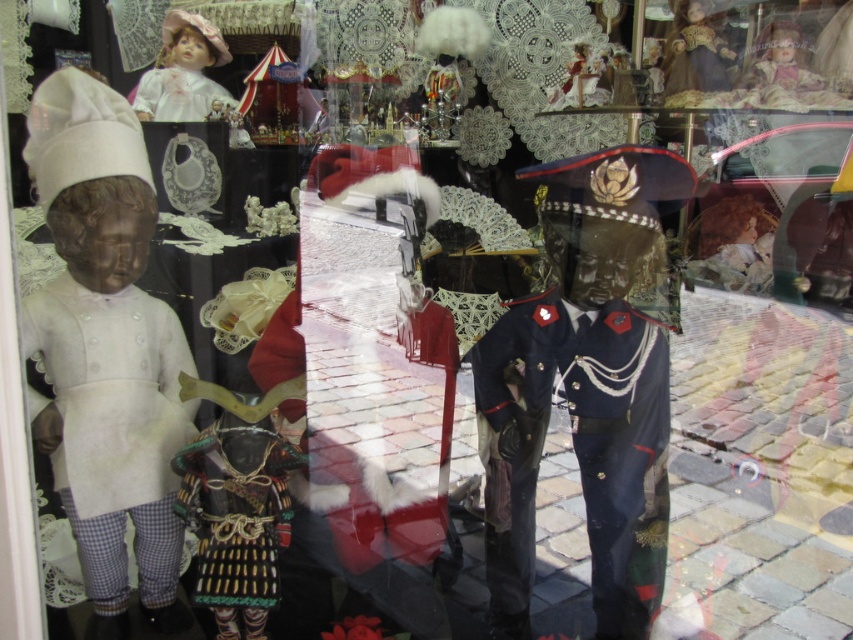
Does white matte fabric at left appear on the right side of porcelain doll at upper left?

Indeed, white matte fabric at left is positioned on the right side of porcelain doll at upper left.

Is white matte fabric at left to the left of porcelain doll at upper left from the viewer's perspective?

No, white matte fabric at left is not to the left of porcelain doll at upper left.

Find the location of a particular element. white matte fabric at left is located at coordinates (112, 413).

Does navy blue fabric uniform at center have a lesser width compared to porcelain doll at upper left?

In fact, navy blue fabric uniform at center might be wider than porcelain doll at upper left.

From the picture: Is navy blue fabric uniform at center to the right of porcelain doll at upper left from the viewer's perspective?

Correct, you'll find navy blue fabric uniform at center to the right of porcelain doll at upper left.

Who is more forward, (x=508, y=545) or (x=187, y=58)?

Point (x=508, y=545) is more forward.

Where is `navy blue fabric uniform at center`? This screenshot has width=853, height=640. navy blue fabric uniform at center is located at coordinates (577, 451).

Can you confirm if white matte fabric at left is shorter than white lace dress at upper left?

In fact, white matte fabric at left may be taller than white lace dress at upper left.

Can you confirm if white matte fabric at left is smaller than white lace dress at upper left?

No.

Who is more forward, (x=177, y=397) or (x=196, y=77)?

Positioned in front is point (x=177, y=397).

The width and height of the screenshot is (853, 640). Identify the location of white matte fabric at left. (112, 413).